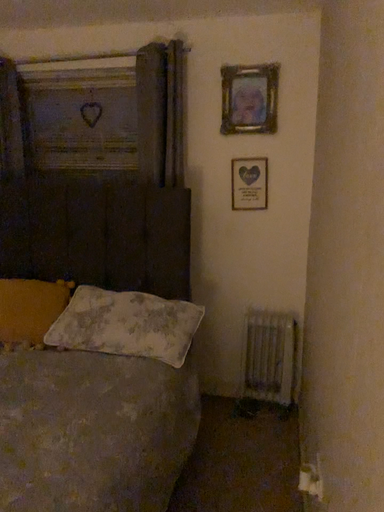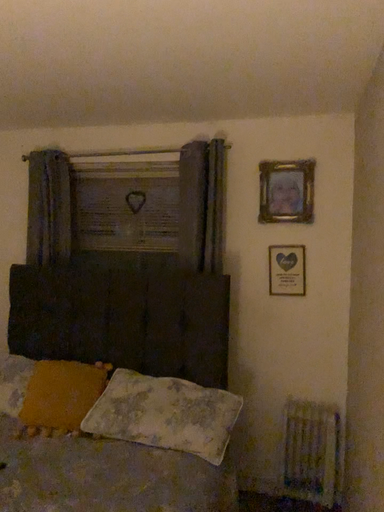
Question: How did the camera likely rotate when shooting the video?

Choices:
 (A) rotated upward
 (B) rotated downward

Answer: (A)